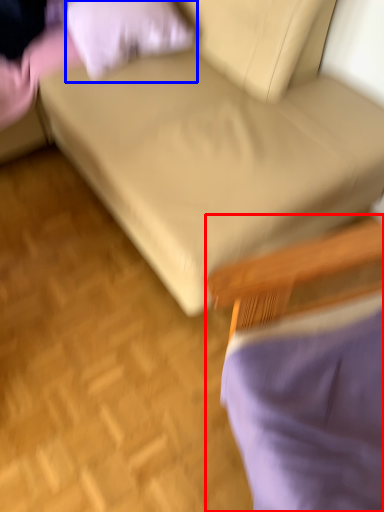
Question: Which point is closer to the camera, chair (highlighted by a red box) or pillow (highlighted by a blue box)?

Choices:
 (A) chair
 (B) pillow

Answer: (A)